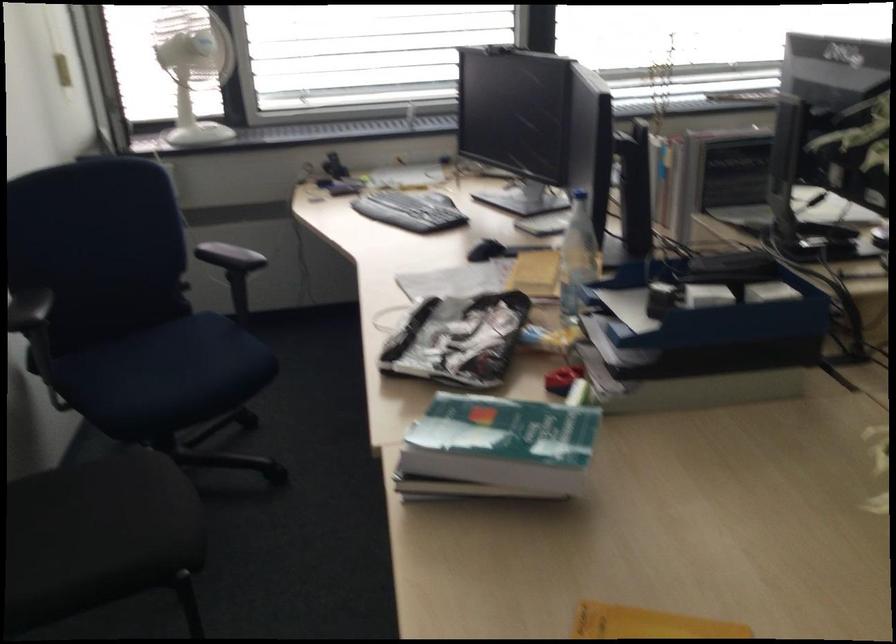
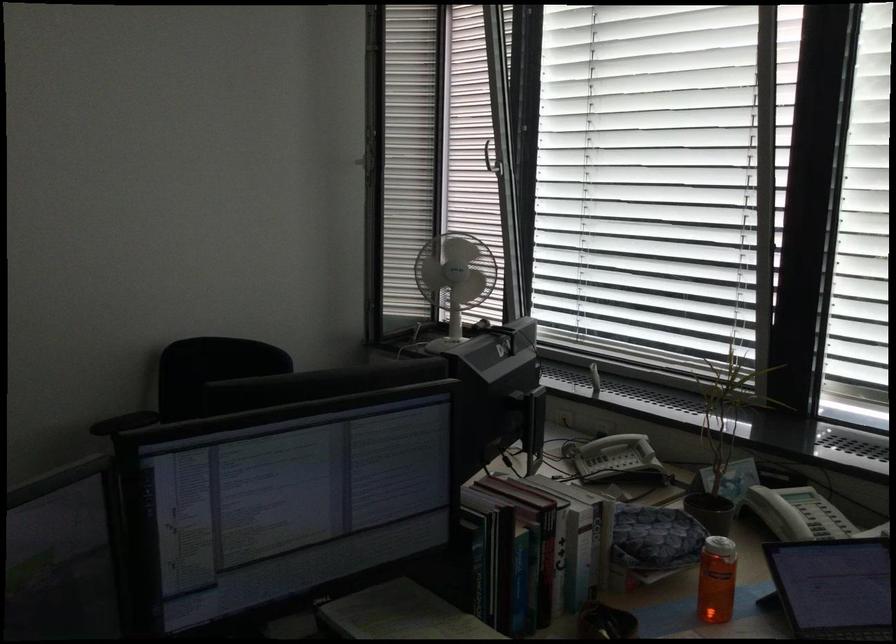
Locate, in the second image, the point that corresponds to point 760,153 in the first image.

(497, 550)